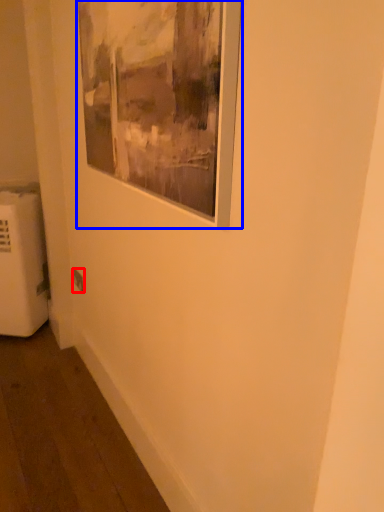
Question: Which object is further to the camera taking this photo, electric outlet (highlighted by a red box) or picture frame (highlighted by a blue box)?

Choices:
 (A) electric outlet
 (B) picture frame

Answer: (A)